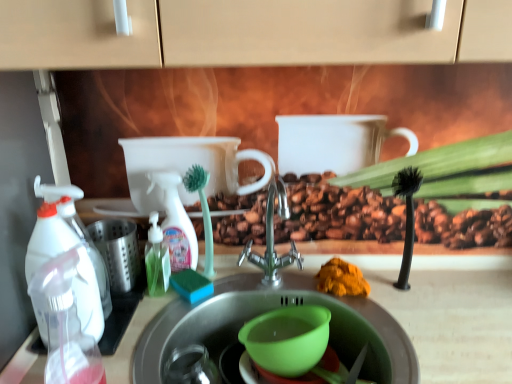
Find the location of a particular element. This screenshot has height=384, width=512. unoccupied region to the right of satin nickel faucet at center is located at coordinates (374, 312).